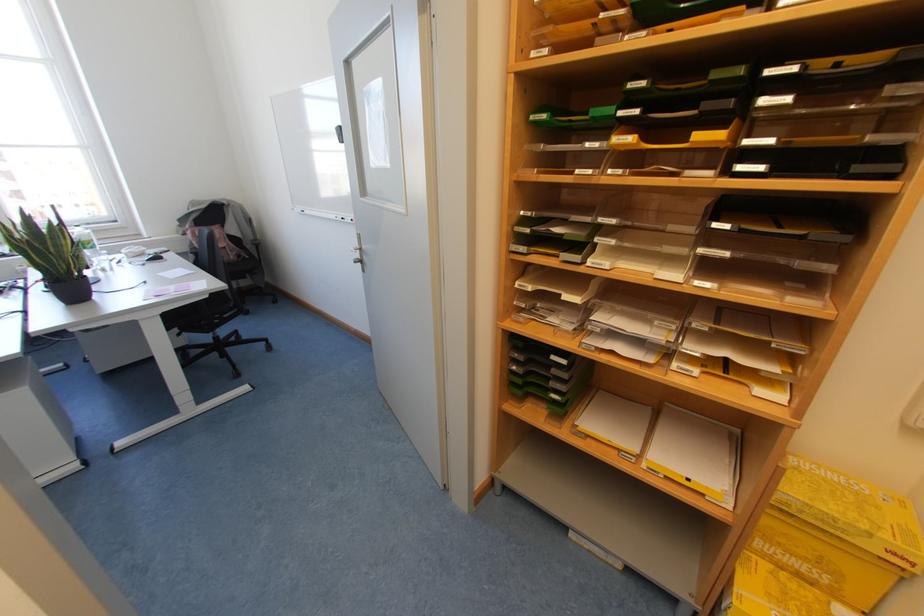
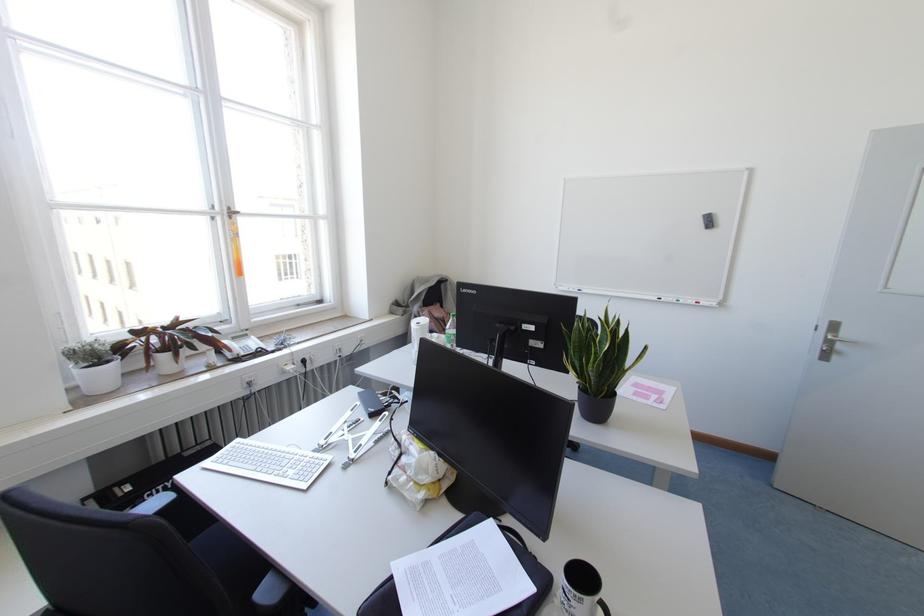
Locate, in the second image, the point that corresponds to (x=302, y=211) in the first image.

(578, 290)